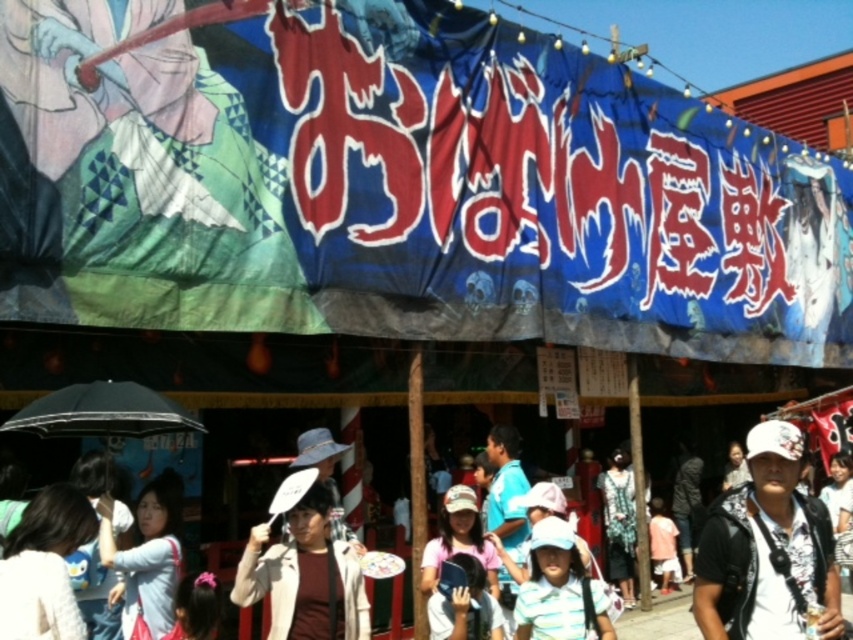
You are standing at the base of the wooden structure under the blue fabric banner at upper center. You want to take a photo of the banner with your smartphone, which has a maximum zoom range of 10x. Considering the distance between you and the banner, can you capture the entire banner in the photo without moving closer?

The distance between you and the blue fabric banner at upper center is 96.61 feet. Since smartphones typically cannot zoom beyond 10x effectively, which is insufficient to capture an object at that distance clearly without moving closer, you would need to move closer to ensure the entire banner fits in the photo.